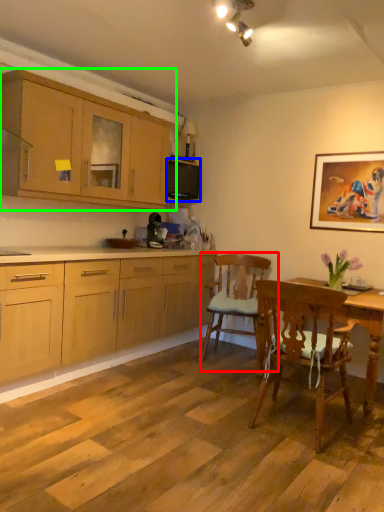
Question: Which object is the closest to the chair (highlighted by a red box)? Choose among these: microwave oven (highlighted by a blue box) or cabinetry (highlighted by a green box).

Choices:
 (A) microwave oven
 (B) cabinetry

Answer: (A)